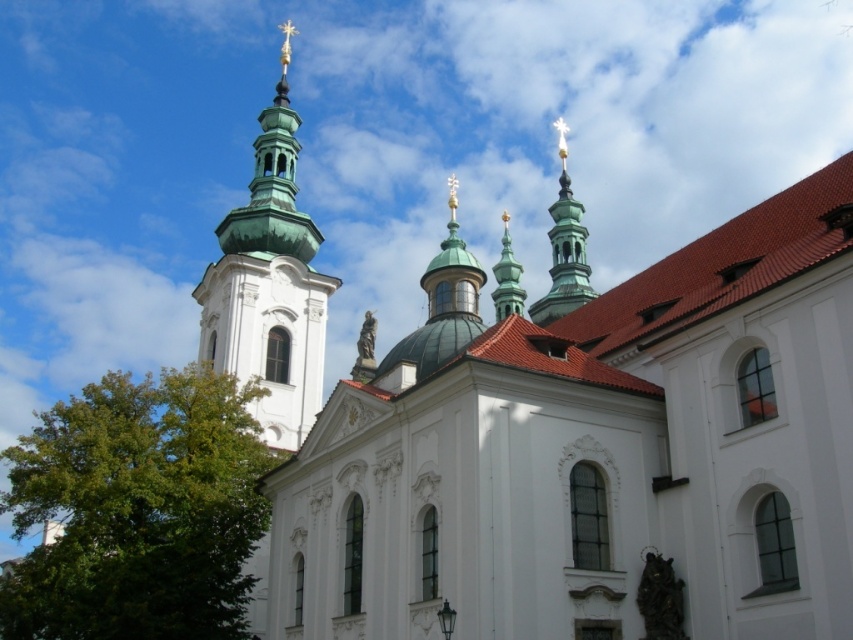
Question: Is green smooth tower at upper left to the left of green polished stone spire at center from the viewer's perspective?

Choices:
 (A) yes
 (B) no

Answer: (A)

Question: Is green smooth tower at upper left closer to camera compared to green polished stone spire at center?

Choices:
 (A) yes
 (B) no

Answer: (A)

Question: Which of the following is the farthest from the observer?

Choices:
 (A) green polished stone spire at center
 (B) green smooth tower at upper left
 (C) green polished stone spire at upper center
 (D) green leafy tree at lower left

Answer: (A)

Question: Does green smooth tower at upper left have a smaller size compared to green polished stone spire at upper center?

Choices:
 (A) no
 (B) yes

Answer: (A)

Question: Which point appears closest to the camera in this image?

Choices:
 (A) (297, 118)
 (B) (126, 616)
 (C) (506, 310)
 (D) (566, 182)

Answer: (B)

Question: Which of these objects is positioned farthest from the green polished stone spire at center?

Choices:
 (A) green polished stone spire at upper center
 (B) green smooth tower at upper left

Answer: (B)